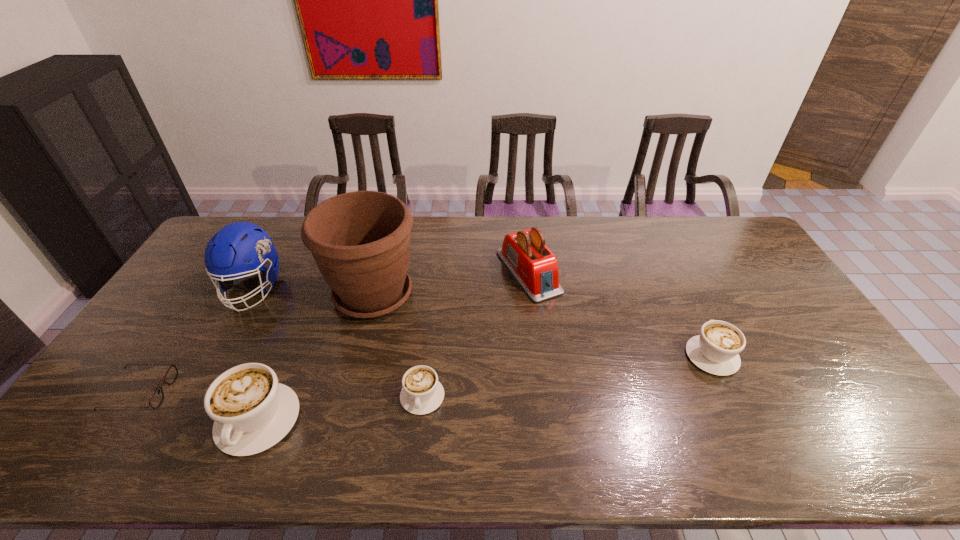
Select which cappuccino is the closest to the flowerpot. Please provide its 2D coordinates. Your answer should be formatted as a tuple, i.e. [(x, y)], where the tuple contains the x and y coordinates of a point satisfying the conditions above.

[(422, 393)]

Where is `vacant space that satisfies the following two spatial constraints: 1. on the front side of the toaster; 2. on the front-facing side of the sunglasses`? The image size is (960, 540). vacant space that satisfies the following two spatial constraints: 1. on the front side of the toaster; 2. on the front-facing side of the sunglasses is located at coordinates (543, 392).